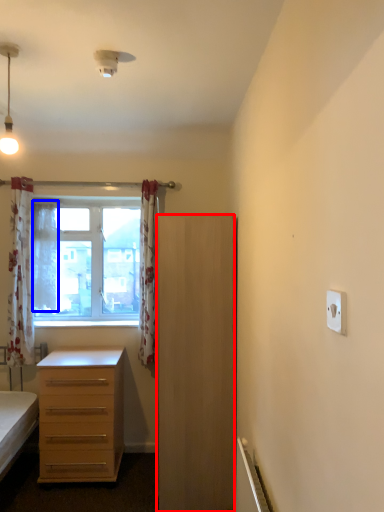
Question: Which of the following is the closest to the observer, cabinetry (highlighted by a red box) or curtain (highlighted by a blue box)?

Choices:
 (A) cabinetry
 (B) curtain

Answer: (A)